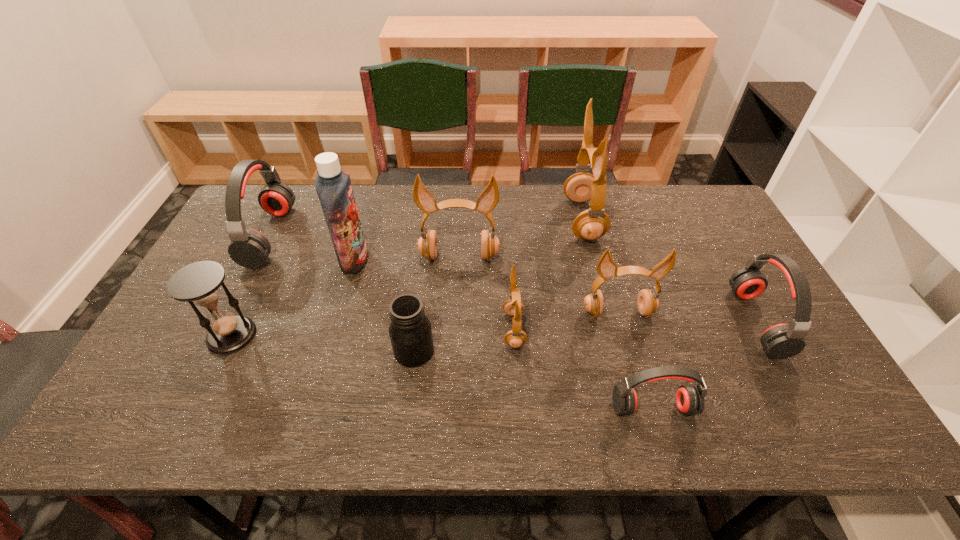
Find the location of `object at the near edge`. object at the near edge is located at coordinates (689, 398).

The height and width of the screenshot is (540, 960). What are the coordinates of `earphone situated at the left edge` in the screenshot? It's located at (249, 248).

Locate an element on the screen. The width and height of the screenshot is (960, 540). hourglass that is at the left edge is located at coordinates (198, 283).

Locate an element on the screen. object present at the right edge is located at coordinates (781, 341).

The width and height of the screenshot is (960, 540). In order to click on object that is at the far left corner in this screenshot , I will do `click(249, 248)`.

At what (x,y) coordinates should I click in order to perform the action: click on free space at the far edge. Please return your answer as a coordinate pair (x, y). The height and width of the screenshot is (540, 960). Looking at the image, I should click on pyautogui.click(x=448, y=215).

Identify the location of free spot at the near edge of the desktop. (538, 430).

Find the location of a particular element. vacant region at the near left corner of the desktop is located at coordinates (142, 419).

The image size is (960, 540). In the image, there is a desktop. Identify the location of blank space at the near right corner. (848, 434).

This screenshot has height=540, width=960. What are the coordinates of `free space between the second smallest red earphone and the blue shampoo` in the screenshot? It's located at (556, 291).